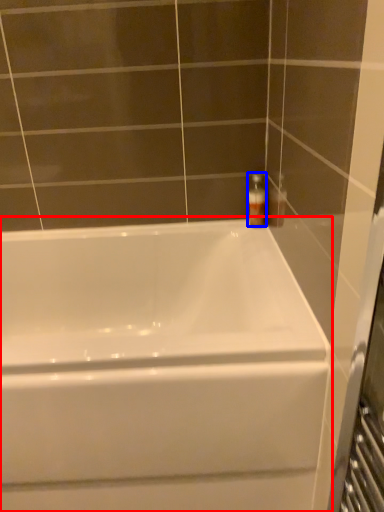
Question: Which of the following is the farthest to the observer, bathtub (highlighted by a red box) or soap dispenser (highlighted by a blue box)?

Choices:
 (A) bathtub
 (B) soap dispenser

Answer: (B)